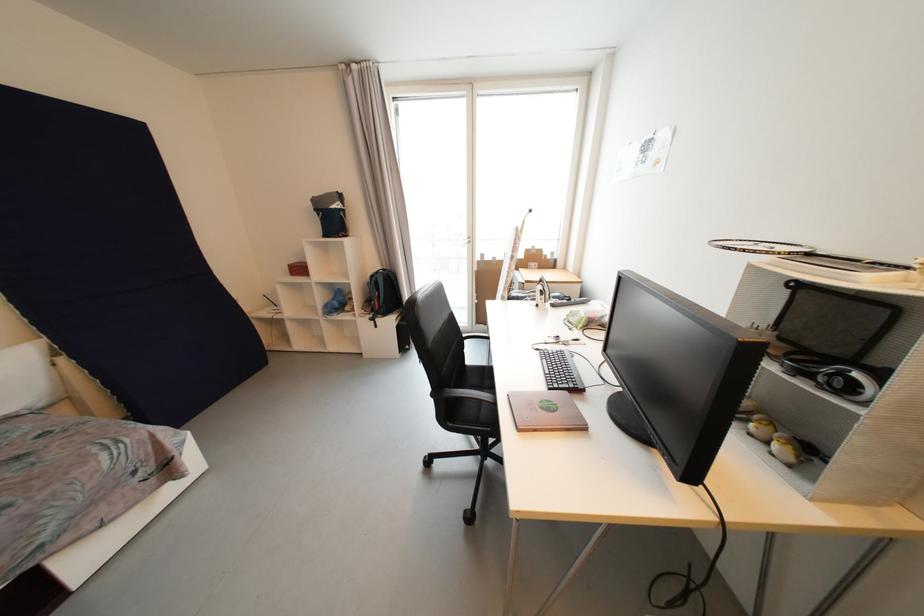
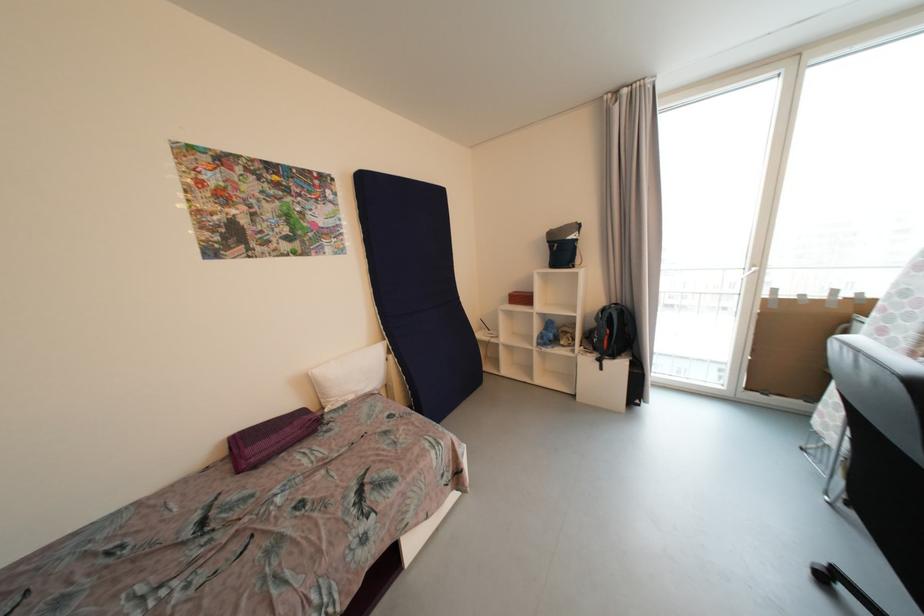
Where in the second image is the point corresponding to (x=305, y=270) from the first image?

(528, 300)